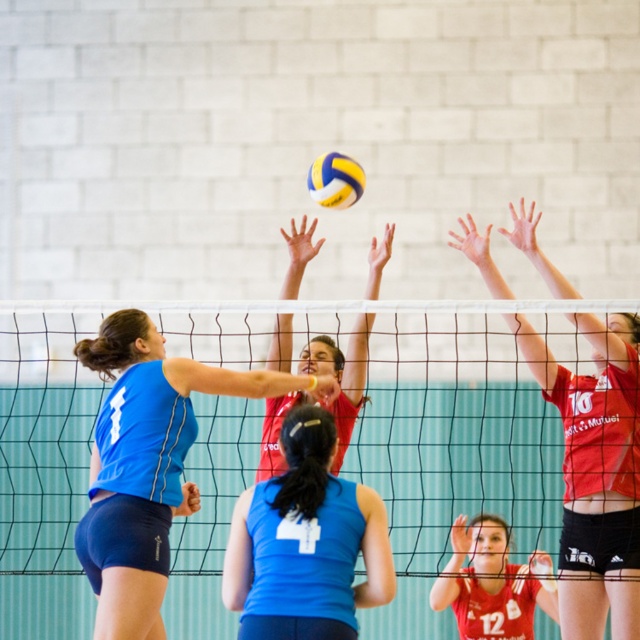
Is point (353, 545) positioned in front of point (467, 593)?

Yes, point (353, 545) is in front of point (467, 593).

The image size is (640, 640). What are the coordinates of `blue matte tank top at center` in the screenshot? It's located at (307, 540).

Does matte red jersey at upper center have a greater height compared to matte red volleyball at center?

Correct, matte red jersey at upper center is much taller as matte red volleyball at center.

Is matte red jersey at upper center positioned behind matte red volleyball at center?

No, matte red jersey at upper center is in front of matte red volleyball at center.

The width and height of the screenshot is (640, 640). What are the coordinates of `matte red jersey at upper center` in the screenshot? It's located at (595, 472).

I want to click on matte red jersey at upper center, so click(x=595, y=472).

Can you confirm if black mesh net at center is thinner than blue jersey at center?

Yes, black mesh net at center is thinner than blue jersey at center.

Can you confirm if black mesh net at center is positioned above blue jersey at center?

Incorrect, black mesh net at center is not positioned above blue jersey at center.

This screenshot has height=640, width=640. I want to click on black mesh net at center, so click(x=428, y=406).

Identify the location of black mesh net at center. (428, 406).